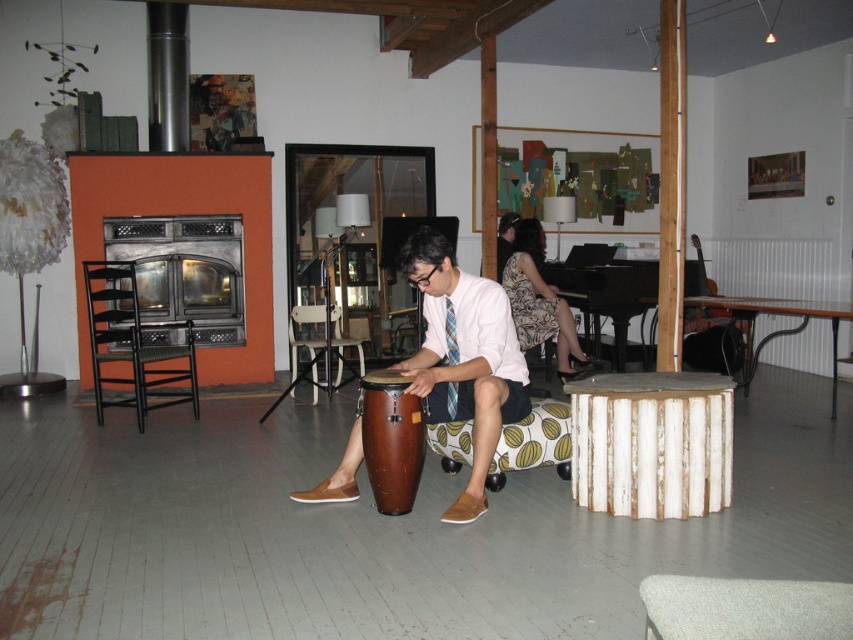
Is brown wooden drum at center behind silky blue tie at center?

No, it is not.

Does brown wooden drum at center have a smaller size compared to silky blue tie at center?

No, brown wooden drum at center is not smaller than silky blue tie at center.

Which is in front, point (421, 420) or point (456, 321)?

Point (421, 420) is more forward.

At what (x,y) coordinates should I click in order to perform the action: click on brown wooden drum at center. Please return your answer as a coordinate pair (x, y). Image resolution: width=853 pixels, height=640 pixels. Looking at the image, I should click on (392, 440).

Is white plastic chair at center to the left of silky blue tie at center from the viewer's perspective?

Indeed, white plastic chair at center is positioned on the left side of silky blue tie at center.

Which is behind, point (349, 380) or point (447, 337)?

The point (349, 380) is behind.

Identify the location of white plastic chair at center. (318, 352).

Can you confirm if brown leather drum at center is smaller than brown wooden drum at center?

Actually, brown leather drum at center might be larger than brown wooden drum at center.

Between point (358, 493) and point (393, 513), which one is positioned in front?

Point (393, 513)

At what (x,y) coordinates should I click in order to perform the action: click on brown leather drum at center. Please return your answer as a coordinate pair (x, y). The width and height of the screenshot is (853, 640). Looking at the image, I should click on (463, 356).